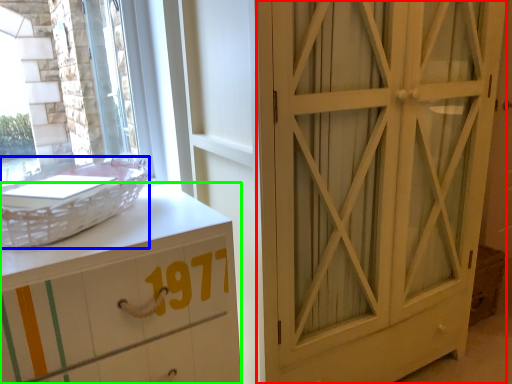
Question: Which is nearer to the door (highlighted by a red box)? basket (highlighted by a blue box) or chest of drawers (highlighted by a green box).

Choices:
 (A) basket
 (B) chest of drawers

Answer: (B)